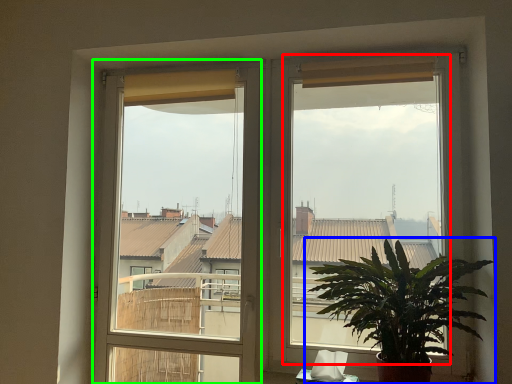
Question: Considering the real-world distances, which object is closest to window screen (highlighted by a red box)? houseplant (highlighted by a blue box) or window frame (highlighted by a green box).

Choices:
 (A) houseplant
 (B) window frame

Answer: (A)